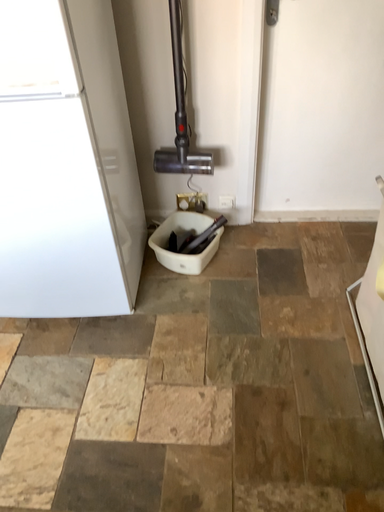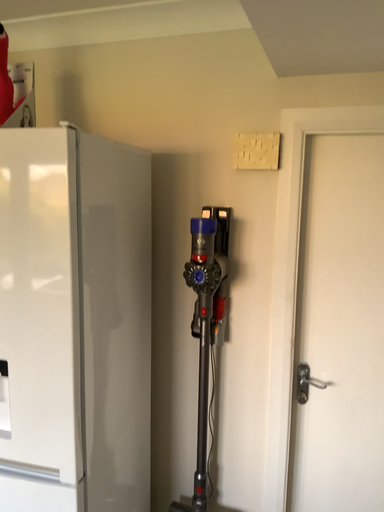
Question: Which way did the camera rotate in the video?

Choices:
 (A) rotated upward
 (B) rotated downward

Answer: (A)